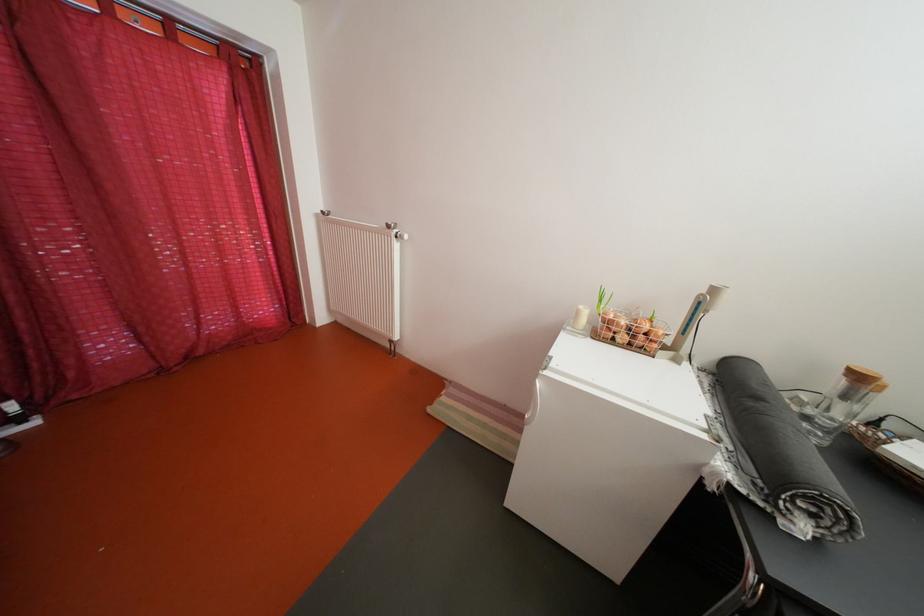
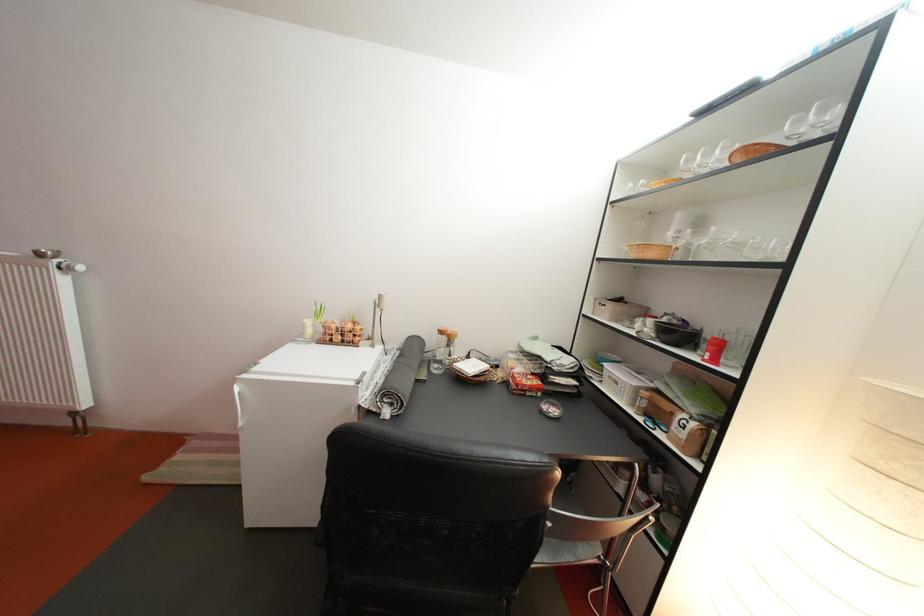
Question: How did the camera likely rotate?

Choices:
 (A) Left
 (B) Right
 (C) Up
 (D) Down

Answer: (B)